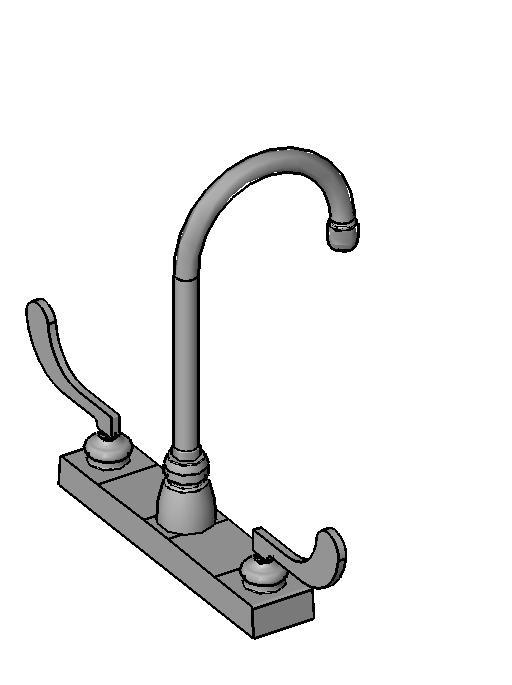
Image resolution: width=512 pixels, height=685 pixels. In order to click on 1 screw for right knob in this screenshot , I will do `click(265, 582)`.